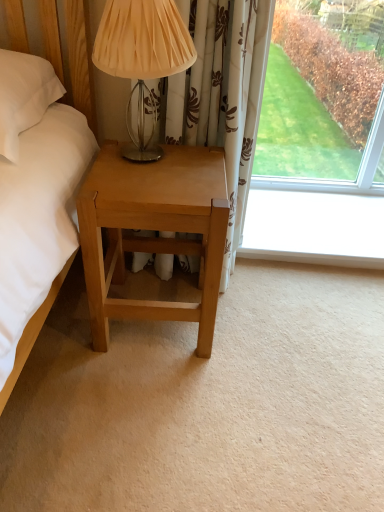
Question: Does point (210, 206) appear closer or farther from the camera than point (148, 159)?

Choices:
 (A) closer
 (B) farther

Answer: (A)

Question: From a real-world perspective, is light brown wood nightstand at lower left positioned above or below matte beige fabric at upper center?

Choices:
 (A) above
 (B) below

Answer: (B)

Question: Considering their positions, is light brown wood nightstand at lower left located in front of or behind matte beige fabric at upper center?

Choices:
 (A) behind
 (B) front

Answer: (A)

Question: Visually, is matte beige fabric at upper center positioned to the left or to the right of light brown wood nightstand at lower left?

Choices:
 (A) left
 (B) right

Answer: (A)

Question: Is matte beige fabric at upper center wider or thinner than light brown wood nightstand at lower left?

Choices:
 (A) wide
 (B) thin

Answer: (B)

Question: In terms of height, does matte beige fabric at upper center look taller or shorter compared to light brown wood nightstand at lower left?

Choices:
 (A) short
 (B) tall

Answer: (A)

Question: Is matte beige fabric at upper center situated inside light brown wood nightstand at lower left or outside?

Choices:
 (A) inside
 (B) outside

Answer: (B)